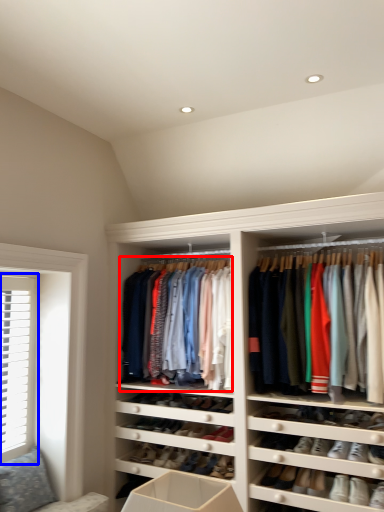
Question: Which object is closer to the camera taking this photo, clothing (highlighted by a red box) or window (highlighted by a blue box)?

Choices:
 (A) clothing
 (B) window

Answer: (B)